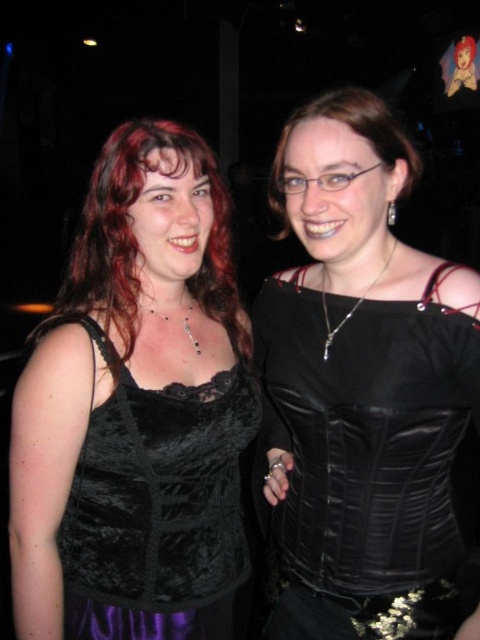
You are a photographer trying to adjust the lighting on the matte black lace top at left and the matte black corset at center. Since both items are matte black, you need to ensure proper exposure. Which object should you focus on first to balance the exposure between them?

The matte black lace top at left is to the left of the matte black corset at center. Since they are both matte black, you should focus on the one closer to the light source first. However, without knowing the light position, prioritize the one needing more adjustment. But according to spatial arrangement, focus on the matte black lace top at left first as it is positioned to the left, which might be in a different light zone.

You are a costume designer preparing for a play. You need to determine the order of layers for two corsets. The satin black corset at center and the matte black corset at center are both part of the costume. Which corset should be placed on top to match the image?

The satin black corset at center is positioned under the matte black corset at center, so the matte black corset at center should be placed on top.

You are a fashion designer who needs to create a new collection. You observe the velvet black top at left and the matte black corset at center in the image. Which of these two items is taller in the photo?

The velvet black top at left is taller than the matte black corset at center.